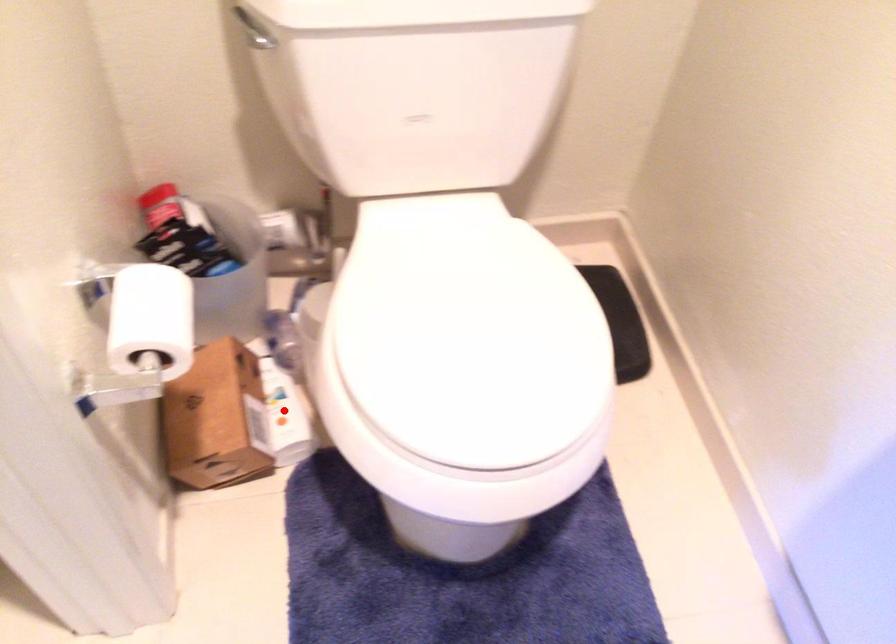
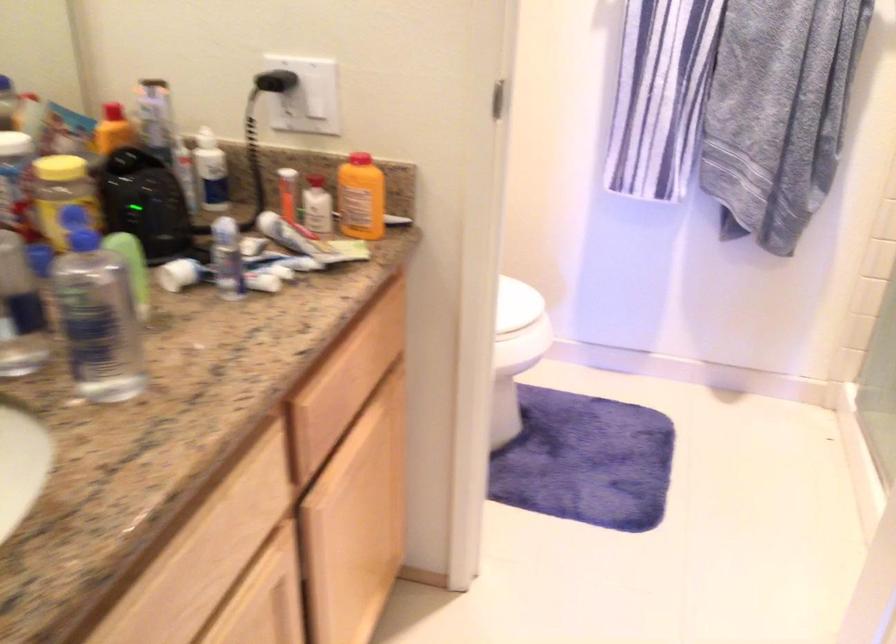
Question: I am providing you with two images of the same scene from different viewpoints. A red point is marked on the first image. At the location where the point appears in image 1, is it still visible in image 2?

Choices:
 (A) Yes
 (B) No

Answer: (B)